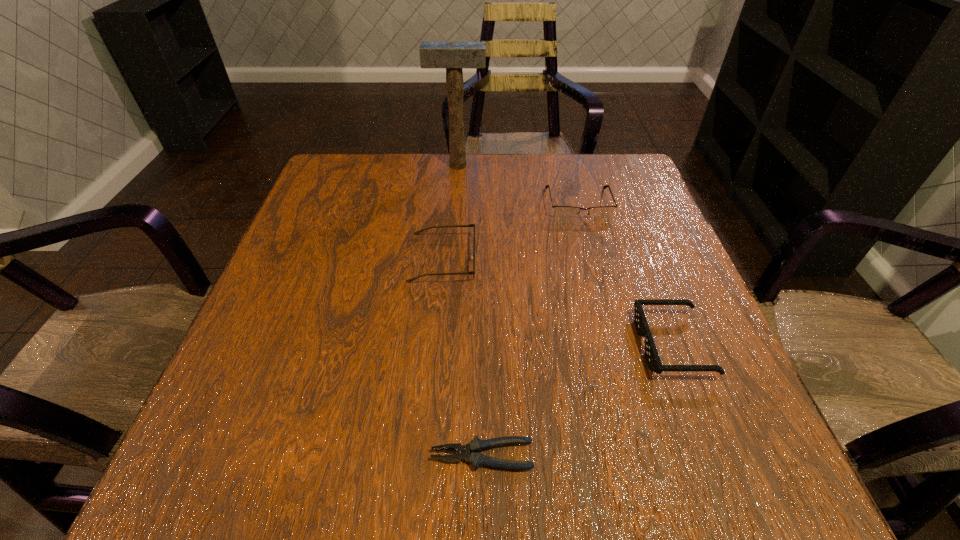
You are a GUI agent. You are given a task and a screenshot of the screen. Output one action in this format:
    pyautogui.click(x=<x>, y=<y>)
    Task: Click on the farthest object
    
    Given the screenshot: What is the action you would take?
    (x=453, y=56)

Find the location of `mallet`. mallet is located at coordinates (453, 56).

Image resolution: width=960 pixels, height=540 pixels. What are the coordinates of `the right spectacles` in the screenshot? It's located at (562, 212).

The width and height of the screenshot is (960, 540). In order to click on the second farthest object in this screenshot , I will do tap(562, 212).

The height and width of the screenshot is (540, 960). Find the location of `the nearer spectacles`. the nearer spectacles is located at coordinates (469, 225).

This screenshot has width=960, height=540. I want to click on the third farthest object, so click(469, 225).

At what (x,y) coordinates should I click in order to perform the action: click on sunglasses. Please return your answer as a coordinate pair (x, y). The image size is (960, 540). Looking at the image, I should click on (651, 354).

In order to click on pliers in this screenshot , I will do `click(476, 459)`.

The image size is (960, 540). Find the location of `the shortest object`. the shortest object is located at coordinates (476, 459).

Locate an element on the screen. vacant area located 0.330m on the right of the tallest object is located at coordinates (604, 165).